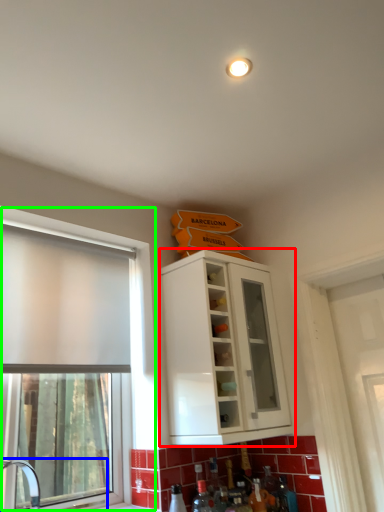
Question: Which object is positioned closest to cabinetry (highlighted by a red box)? Select from sink (highlighted by a blue box) and window (highlighted by a green box).

Choices:
 (A) sink
 (B) window

Answer: (B)